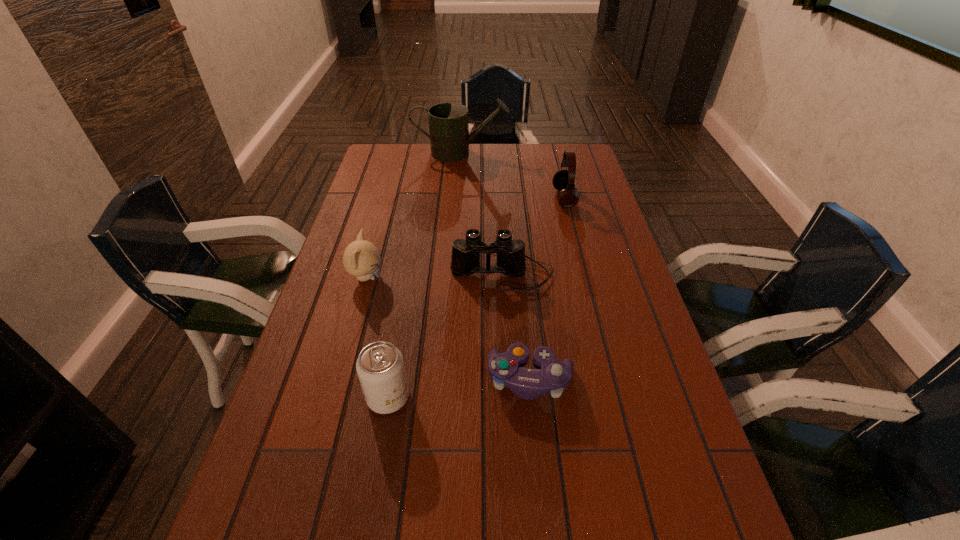
Find the location of `free space between the fifth shortest object and the soda can`. free space between the fifth shortest object and the soda can is located at coordinates (476, 298).

Where is `free area in between the control and the soda can`? The image size is (960, 540). free area in between the control and the soda can is located at coordinates (459, 388).

Identify the location of vacant area that lies between the binoculars and the soda can. (445, 336).

Identify the location of empty space that is in between the rightmost object and the tallest object. (513, 176).

The width and height of the screenshot is (960, 540). Identify the location of vacant point located between the soda can and the kitten. (377, 338).

Identify which object is located as the fourth nearest to the kitten. Please provide its 2D coordinates. Your answer should be formatted as a tuple, i.e. [(x, y)], where the tuple contains the x and y coordinates of a point satisfying the conditions above.

[(568, 196)]

Identify which object is the second nearest to the farthest object. Please provide its 2D coordinates. Your answer should be formatted as a tuple, i.e. [(x, y)], where the tuple contains the x and y coordinates of a point satisfying the conditions above.

[(465, 260)]

At what (x,y) coordinates should I click in order to perform the action: click on vacant space that satisfies the following two spatial constraints: 1. on the back side of the control; 2. with the spout on the farthest object. Please return your answer as a coordinate pair (x, y). This screenshot has height=540, width=960. Looking at the image, I should click on (508, 153).

This screenshot has width=960, height=540. What are the coordinates of `vacant area in the image that satisfies the following two spatial constraints: 1. on the face of the kitten; 2. on the left side of the soda can` in the screenshot? It's located at (333, 397).

This screenshot has width=960, height=540. I want to click on vacant space that satisfies the following two spatial constraints: 1. with the spout on the farthest object; 2. on the back side of the control, so click(x=445, y=380).